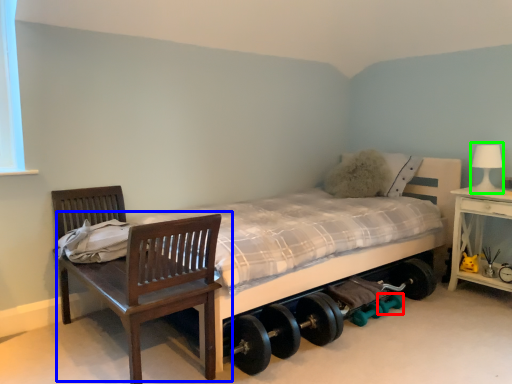
Question: Considering the real-world distances, which object is closest to dumbbell (highlighted by a red box)? chair (highlighted by a blue box) or table lamp (highlighted by a green box).

Choices:
 (A) chair
 (B) table lamp

Answer: (B)